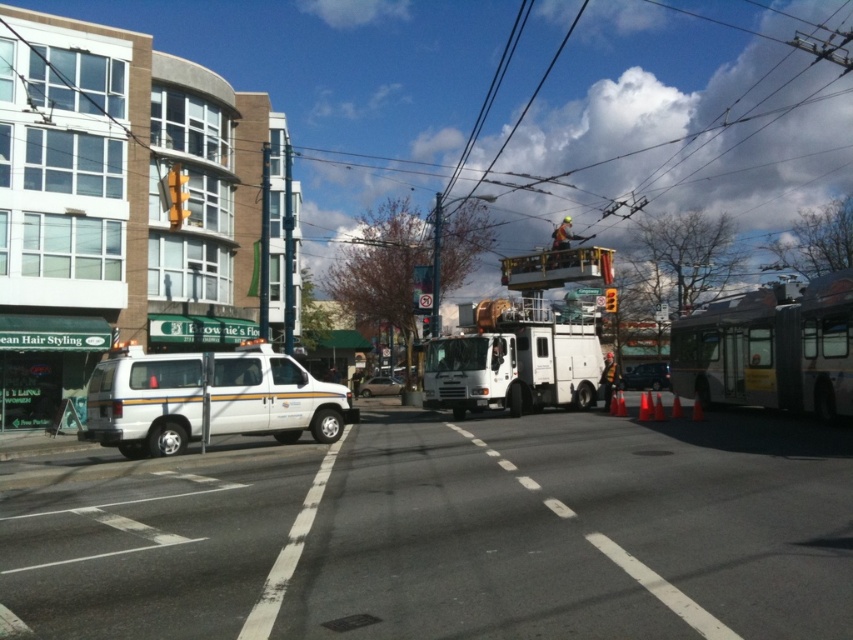
Question: Which point is farther to the camera?

Choices:
 (A) (590, 333)
 (B) (843, 282)
 (C) (338, 403)

Answer: (A)

Question: Can you confirm if yellow matte traffic light at upper center is smaller than yellow plastic traffic light at center?

Choices:
 (A) no
 (B) yes

Answer: (B)

Question: Can you confirm if yellow matte traffic light at upper center is smaller than yellow plastic traffic light at center?

Choices:
 (A) yes
 (B) no

Answer: (A)

Question: Which point is closer to the camera?

Choices:
 (A) (163, 408)
 (B) (427, 336)
 (C) (378, 385)

Answer: (A)

Question: Does yellow matte traffic light at upper center appear on the right side of metallic traffic light at center?

Choices:
 (A) no
 (B) yes

Answer: (A)

Question: Which object is closer to the camera taking this photo?

Choices:
 (A) white utility truck at center
 (B) yellow plastic traffic light at center
 (C) metallic traffic light at center

Answer: (A)